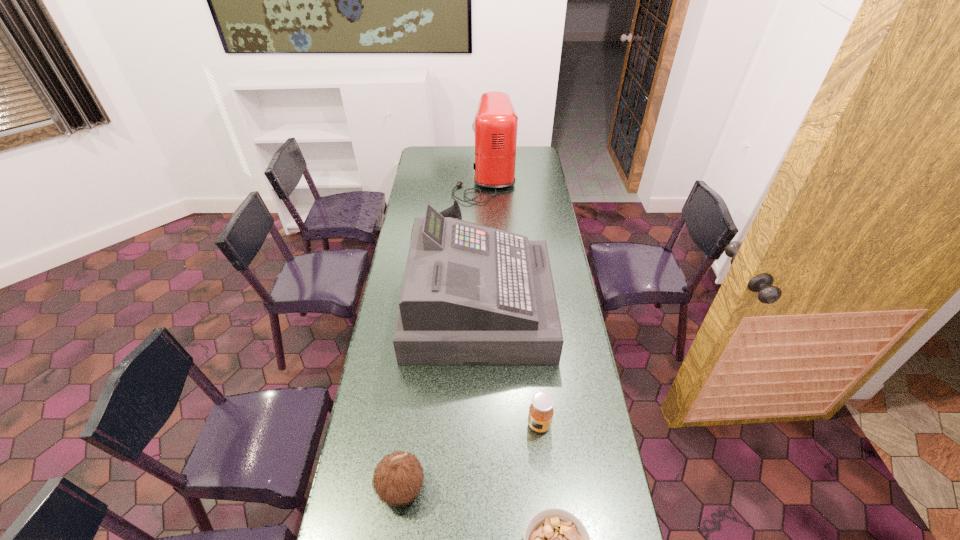
The image size is (960, 540). In order to click on free location located 0.230m on the front-facing side of the fifth tallest object in this screenshot , I will do `click(455, 424)`.

At what (x,y) coordinates should I click in order to perform the action: click on free space located on the front-facing side of the fifth tallest object. Please return your answer as a coordinate pair (x, y). Image resolution: width=960 pixels, height=540 pixels. Looking at the image, I should click on pyautogui.click(x=445, y=424).

Locate an element on the screen. blank area located on the front-facing side of the fifth tallest object is located at coordinates tap(436, 424).

Find the location of a particular element. Image resolution: width=960 pixels, height=540 pixels. object located at the far edge is located at coordinates (495, 127).

In order to click on cash register present at the left edge in this screenshot , I will do `click(472, 295)`.

Image resolution: width=960 pixels, height=540 pixels. What are the coordinates of `coconut located in the left edge section of the desktop` in the screenshot? It's located at (398, 478).

Identify the location of phonograph_record at the left edge. (454, 211).

Image resolution: width=960 pixels, height=540 pixels. What are the coordinates of `cash register situated at the right edge` in the screenshot? It's located at coord(472,295).

Where is `honey present at the right edge`? The image size is (960, 540). honey present at the right edge is located at coordinates (541, 411).

At what (x,y) coordinates should I click in order to perform the action: click on free space at the far edge. Please return your answer as a coordinate pair (x, y). The image size is (960, 540). Looking at the image, I should click on (471, 157).